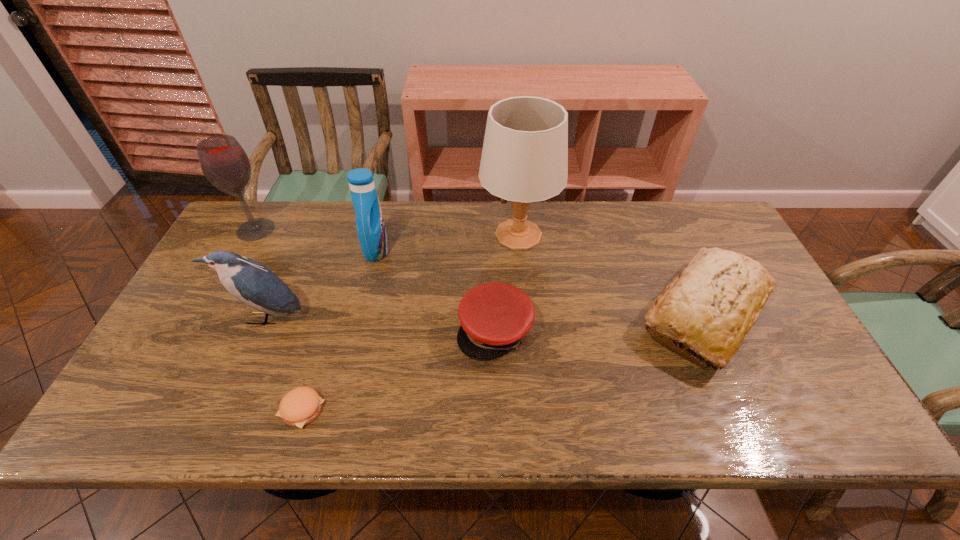
Identify the location of table lamp. (524, 159).

Locate an element on the screen. alcohol is located at coordinates [x=223, y=161].

At what (x,y) coordinates should I click in order to perform the action: click on detergent. Please return your answer as a coordinate pair (x, y). The image size is (960, 540). Looking at the image, I should click on (370, 225).

Locate an element on the screen. This screenshot has width=960, height=540. bird is located at coordinates (249, 281).

Find the location of a particular element. Image resolution: width=960 pixels, height=540 pixels. bread is located at coordinates (711, 306).

Where is `the rightmost object`? the rightmost object is located at coordinates (711, 306).

The height and width of the screenshot is (540, 960). Identify the location of the sixth tallest object. (494, 317).

Image resolution: width=960 pixels, height=540 pixels. I want to click on the shortest object, so click(300, 406).

Locate an element on the screen. the nearest object is located at coordinates (300, 406).

Where is `vacant region located 0.360m on the right of the tallest object`? This screenshot has height=540, width=960. vacant region located 0.360m on the right of the tallest object is located at coordinates (672, 235).